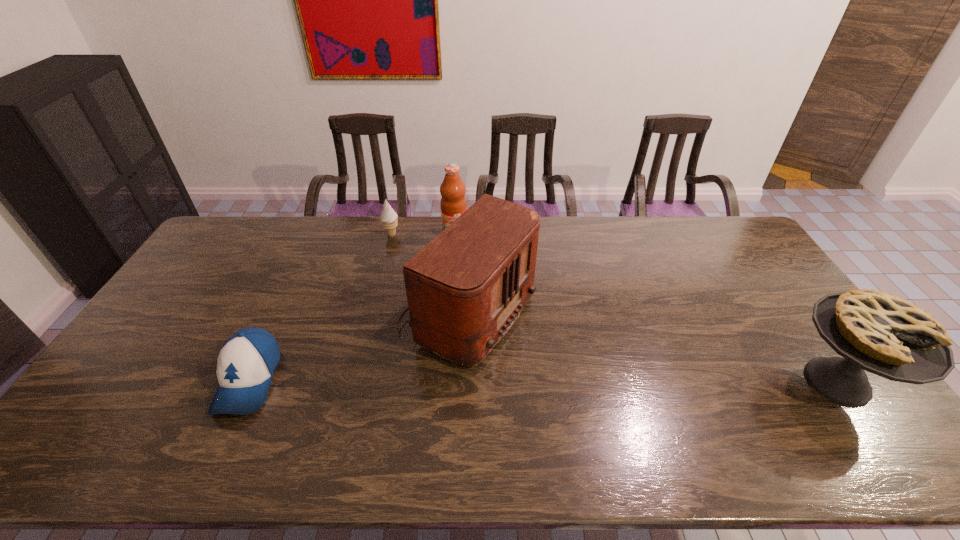
Where is `the shortest object`? This screenshot has width=960, height=540. the shortest object is located at coordinates tap(247, 361).

The width and height of the screenshot is (960, 540). Find the location of `baseball cap`. baseball cap is located at coordinates (247, 361).

Image resolution: width=960 pixels, height=540 pixels. What are the coordinates of `the rightmost object` in the screenshot? It's located at (875, 331).

Where is `fruit juice`? fruit juice is located at coordinates (453, 203).

The height and width of the screenshot is (540, 960). I want to click on radio receiver, so click(x=465, y=289).

At what (x,y) coordinates should I click in order to perform the action: click on the fourth tallest object. Please return your answer as a coordinate pair (x, y). Looking at the image, I should click on (389, 217).

You are a GUI agent. You are given a task and a screenshot of the screen. Output one action in this format:
    pyautogui.click(x=<x>, y=<y>)
    Task: Click on the second object from left to right
    This screenshot has height=540, width=960.
    Given the screenshot: What is the action you would take?
    pyautogui.click(x=389, y=217)

In order to click on vacant area situated 0.280m on the front label of the fruit juice in this screenshot , I will do `click(470, 293)`.

Where is `free space located 0.130m on the front label of the fruit juice`? The image size is (960, 540). free space located 0.130m on the front label of the fruit juice is located at coordinates (463, 264).

Where is `free space located 0.080m on the front label of the fruit juice`? The image size is (960, 540). free space located 0.080m on the front label of the fruit juice is located at coordinates click(x=461, y=254).